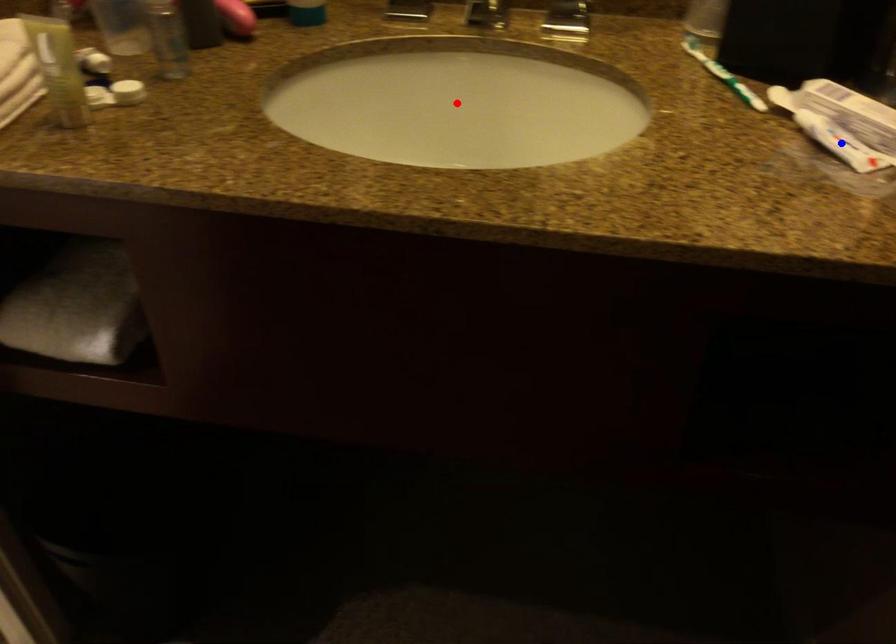
Question: In the image, two points are highlighted. Which point is nearer to the camera? Reply with the corresponding letter.

Choices:
 (A) blue point
 (B) red point

Answer: (A)